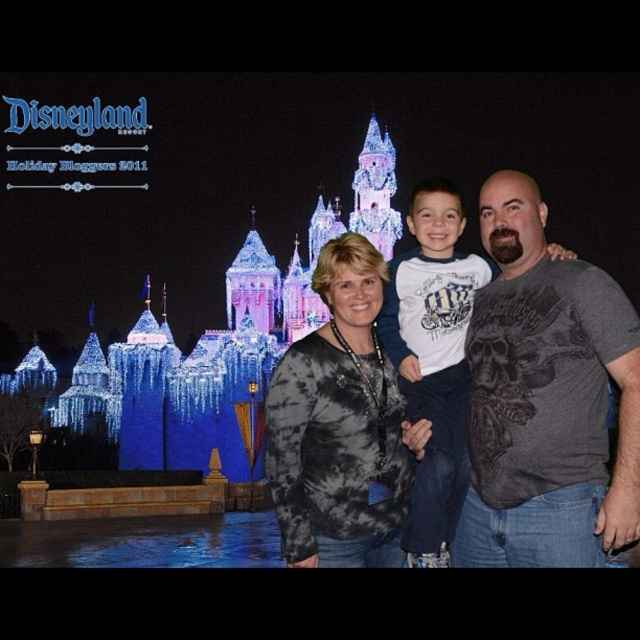
Question: Can you confirm if black tie-dye shirt at center is wider than tie-dye long-sleeve shirt at center?

Choices:
 (A) no
 (B) yes

Answer: (B)

Question: Can you confirm if black tie-dye shirt at center is wider than white cotton shirt at center?

Choices:
 (A) no
 (B) yes

Answer: (B)

Question: Which of the following is the farthest from the observer?

Choices:
 (A) (291, 420)
 (B) (424, 195)

Answer: (B)

Question: Which object is positioned farthest from the tie-dye long-sleeve shirt at center?

Choices:
 (A) black tie-dye shirt at center
 (B) gray printed t-shirt at center
 (C) white cotton shirt at center

Answer: (B)

Question: Which of these objects is positioned closest to the gray printed t-shirt at center?

Choices:
 (A) black tie-dye shirt at center
 (B) white cotton shirt at center
 (C) tie-dye long-sleeve shirt at center

Answer: (A)

Question: Is black tie-dye shirt at center bigger than gray printed t-shirt at center?

Choices:
 (A) yes
 (B) no

Answer: (A)